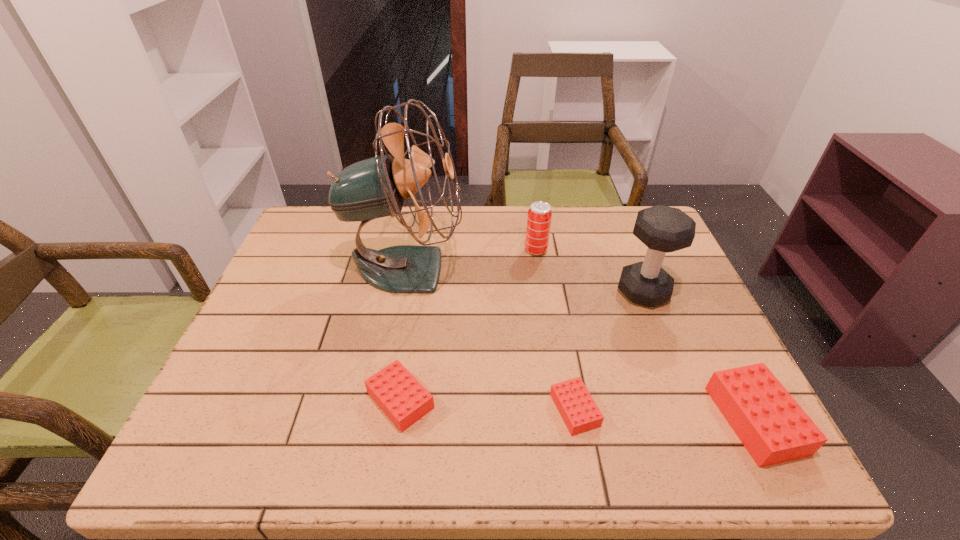
Locate which Lego ranks in proximity to the soda can. Please provide its 2D coordinates. Your answer should be formatted as a tuple, i.e. [(x, y)], where the tuple contains the x and y coordinates of a point satisfying the conditions above.

[(575, 404)]

Select which Lego is the second closest to the soda can. Please provide its 2D coordinates. Your answer should be formatted as a tuple, i.e. [(x, y)], where the tuple contains the x and y coordinates of a point satisfying the conditions above.

[(396, 391)]

This screenshot has width=960, height=540. In order to click on blank area in the image that satisfies the following two spatial constraints: 1. on the front side of the shortest Lego; 2. on the right side of the soda can in this screenshot , I will do `click(560, 410)`.

You are a GUI agent. You are given a task and a screenshot of the screen. Output one action in this format:
    pyautogui.click(x=<x>, y=<y>)
    Task: Click on the free region that satisfies the following two spatial constraints: 1. on the front-facing side of the fifth shortest object for air flow; 2. on the left side of the fan
    
    Given the screenshot: What is the action you would take?
    pyautogui.click(x=401, y=292)

This screenshot has width=960, height=540. In order to click on vacant area that satisfies the following two spatial constraints: 1. on the front side of the soda can; 2. on the front-facing side of the fan for air flow in this screenshot , I will do `click(539, 268)`.

Identify the location of free space that satisfies the following two spatial constraints: 1. on the front-facing side of the tallest object for air flow; 2. on the back side of the second shortest Lego. The height and width of the screenshot is (540, 960). (381, 400).

Locate an element on the screen. vacant area that satisfies the following two spatial constraints: 1. on the front-facing side of the leftmost Lego for air flow; 2. on the right side of the fan is located at coordinates (381, 400).